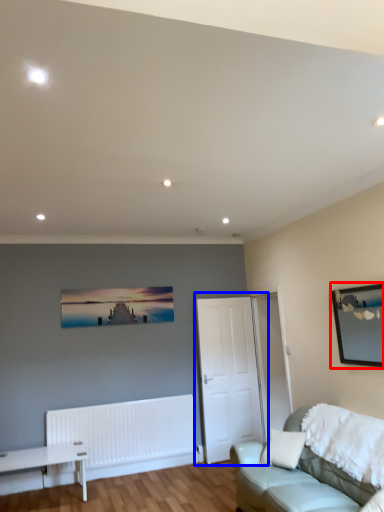
Question: Which point is closer to the camera, picture frame (highlighted by a red box) or door (highlighted by a blue box)?

Choices:
 (A) picture frame
 (B) door

Answer: (A)